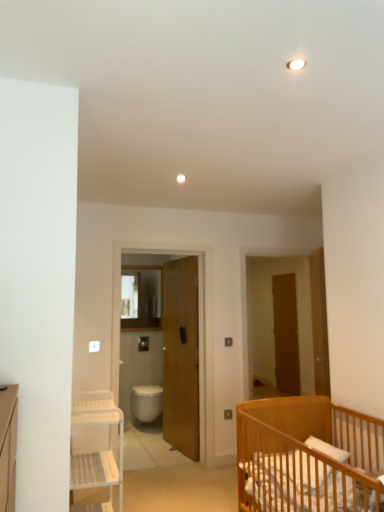
Identify the location of wooden door at center, marked as the 2th door in a front-to-back arrangement. (181, 355).

The height and width of the screenshot is (512, 384). What do you see at coordinates (146, 402) in the screenshot?
I see `white glossy toilet bowl at center` at bounding box center [146, 402].

Image resolution: width=384 pixels, height=512 pixels. Find the location of `light brown wooden crib at lower right`. light brown wooden crib at lower right is located at coordinates (308, 456).

This screenshot has width=384, height=512. Identify the location of white plastic shelf at left. (97, 448).

Identify the location of wooden door at center, acting as the first door starting from the left. (181, 355).

Is white plastic shelf at left not inside light brown wooden crib at lower right?

Yes, white plastic shelf at left is located beyond the bounds of light brown wooden crib at lower right.

From a real-world perspective, is white plastic shelf at left positioned above or below light brown wooden crib at lower right?

white plastic shelf at left is situated higher than light brown wooden crib at lower right in the real world.

Considering the sizes of objects white plastic shelf at left and light brown wooden crib at lower right in the image provided, who is bigger, white plastic shelf at left or light brown wooden crib at lower right?

With larger size is light brown wooden crib at lower right.

Is wooden door at center, marked as the 2th door in a front-to-back arrangement, at the right side of light brown wooden crib at lower right?

No.

From a real-world perspective, which is physically above, wooden door at center, marked as the 2th door in a front-to-back arrangement, or light brown wooden crib at lower right?

wooden door at center, marked as the 2th door in a front-to-back arrangement, is physically above.

Which object is more forward, wooden door at center, which appears as the 3th door when viewed from the right, or light brown wooden crib at lower right?

light brown wooden crib at lower right is more forward.

Measure the distance between wooden door at right, which is the 2th door from left to right, and white plastic shelf at left.

They are 2.06 meters apart.

Which of these two, wooden door at right, the second door viewed from the right, or white plastic shelf at left, stands shorter?

white plastic shelf at left is shorter.

Is wooden door at right, the second door viewed from the right, to the left or to the right of white plastic shelf at left in the image?

wooden door at right, the second door viewed from the right, is to the right of white plastic shelf at left.

Is the depth of wooden door at right, the second door viewed from the right, greater than that of white plastic shelf at left?

Yes.

Between wooden door at right, the second door viewed from the right, and light brown wooden crib at lower right, which one has smaller size?

With smaller size is wooden door at right, the second door viewed from the right.

Which of these two, wooden door at right, which is the 2th door from left to right, or light brown wooden crib at lower right, stands taller?

With more height is wooden door at right, which is the 2th door from left to right.

Which point is more forward, (323, 319) or (279, 490)?

The point (279, 490) is closer to the camera.

From the image's perspective, is wooden door at right, which is the 2th door from left to right, positioned above or below light brown wooden crib at lower right?

From the image's perspective, wooden door at right, which is the 2th door from left to right, appears above light brown wooden crib at lower right.

Is white plastic shelf at left oriented away from white glossy toilet bowl at center?

No.

Can you confirm if white plastic shelf at left is shorter than white glossy toilet bowl at center?

In fact, white plastic shelf at left may be taller than white glossy toilet bowl at center.

From the image's perspective, would you say white plastic shelf at left is shown under white glossy toilet bowl at center?

Actually, white plastic shelf at left appears above white glossy toilet bowl at center in the image.

Does brown wooden door at center-right, the third door in the front-to-back sequence, turn towards wooden screen door at center?

No, brown wooden door at center-right, the third door in the front-to-back sequence, is not aimed at wooden screen door at center.

At what (x,y) coordinates should I click in order to perform the action: click on screen door located above the brown wooden door at center-right, the third door in the front-to-back sequence (from the image's perspective). Please return your answer as a coordinate pair (x, y). The width and height of the screenshot is (384, 512). Looking at the image, I should click on (183, 355).

Does brown wooden door at center-right, the third door in the front-to-back sequence, have a lesser width compared to wooden screen door at center?

Correct, the width of brown wooden door at center-right, the third door in the front-to-back sequence, is less than that of wooden screen door at center.

From a real-world perspective, is brown wooden door at center-right, the 1th door viewed from the right, below wooden screen door at center?

Yes, from a real-world perspective, brown wooden door at center-right, the 1th door viewed from the right, is beneath wooden screen door at center.

Can wooden door at right, the second door viewed from the right, be found inside wooden screen door at center?

Definitely not — wooden door at right, the second door viewed from the right, is not inside wooden screen door at center.

From the image's perspective, which is above, wooden screen door at center or wooden door at right, which is the 2th door from left to right?

wooden door at right, which is the 2th door from left to right, appears higher in the image.

From a real-world perspective, who is located lower, wooden screen door at center or wooden door at right, acting as the third door starting from the back?

In real-world perspective, wooden screen door at center is lower.

Between wooden screen door at center and wooden door at right, acting as the third door starting from the back, which one has more height?

With more height is wooden screen door at center.

Find the location of a particular element. The height and width of the screenshot is (512, 384). infant bed lying above the white plastic shelf at left (from the image's perspective) is located at coordinates (308, 456).

What are the coordinates of `infant bed below the wooden door at center, which is the 2th door from back to front (from the image's perspective)` in the screenshot? It's located at (308, 456).

From the image, which object appears to be farther from brown wooden door at center-right, the third door in the front-to-back sequence, wooden door at right, the first door in the front-to-back sequence, or wooden screen door at center?

wooden screen door at center is further to brown wooden door at center-right, the third door in the front-to-back sequence.

Estimate the real-world distances between objects in this image. Which object is closer to light brown wooden crib at lower right, white glossy toilet bowl at center or wooden door at right, the first door in the front-to-back sequence?

The object closer to light brown wooden crib at lower right is wooden door at right, the first door in the front-to-back sequence.

From the image, which object appears to be farther from brown wooden door at center-right, the first door when ordered from back to front, white plastic shelf at left or light brown wooden crib at lower right?

white plastic shelf at left is further to brown wooden door at center-right, the first door when ordered from back to front.

Based on their spatial positions, is wooden door at right, the second door viewed from the right, or white plastic shelf at left closer to light brown wooden crib at lower right?

wooden door at right, the second door viewed from the right, lies closer to light brown wooden crib at lower right than the other object.

Looking at the image, which one is located closer to wooden door at center, acting as the first door starting from the left, light brown wooden crib at lower right or white plastic shelf at left?

white plastic shelf at left is positioned closer to the anchor wooden door at center, acting as the first door starting from the left.

Looking at the image, which one is located further to light brown wooden crib at lower right, wooden screen door at center or wooden door at center, which appears as the 3th door when viewed from the right?

wooden door at center, which appears as the 3th door when viewed from the right, is further to light brown wooden crib at lower right.

Looking at the image, which one is located closer to wooden screen door at center, light brown wooden crib at lower right or white plastic shelf at left?

white plastic shelf at left lies closer to wooden screen door at center than the other object.

Considering their positions, is white plastic shelf at left positioned further to light brown wooden crib at lower right than brown wooden door at center-right, the third door in the front-to-back sequence?

Based on the image, brown wooden door at center-right, the third door in the front-to-back sequence, appears to be further to light brown wooden crib at lower right.

In order to click on screen door between light brown wooden crib at lower right and white glossy toilet bowl at center along the z-axis in this screenshot , I will do `click(183, 355)`.

Find the location of a particular element. door positioned between light brown wooden crib at lower right and wooden door at center, which is the 2th door from back to front, from near to far is located at coordinates pos(319,323).

You are a GUI agent. You are given a task and a screenshot of the screen. Output one action in this format:
    pyautogui.click(x=<x>, y=<y>)
    Task: Click on the door between white glossy toilet bowl at center and wooden door at right, the first door in the front-to-back sequence, from left to right
    
    Given the screenshot: What is the action you would take?
    pyautogui.click(x=181, y=355)

Find the location of a particular element. The image size is (384, 512). door between wooden screen door at center and brown wooden door at center-right, the first door when ordered from back to front, along the z-axis is located at coordinates (181, 355).